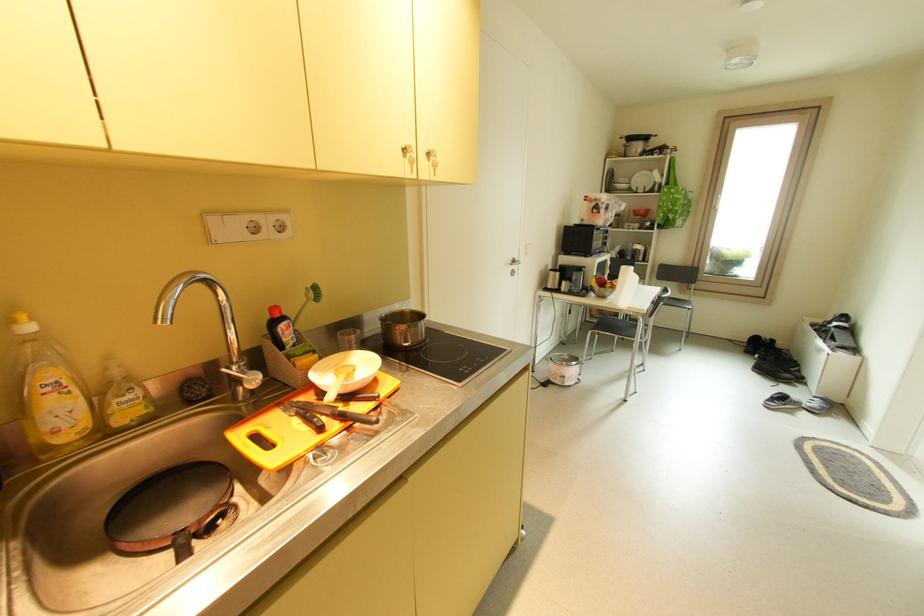
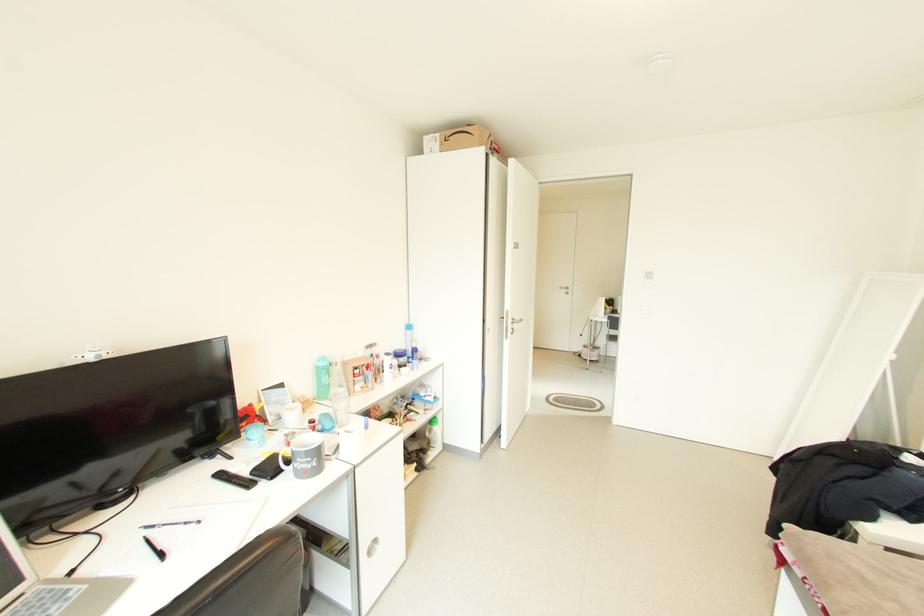
Question: I am providing you with two images of the same scene from different viewpoints. Which of the following objects are not visible in image2?

Choices:
 (A) gray doorstop
 (B) blue-capped bottle
 (C) sink faucet handle
 (D) metal door handle

Answer: (C)